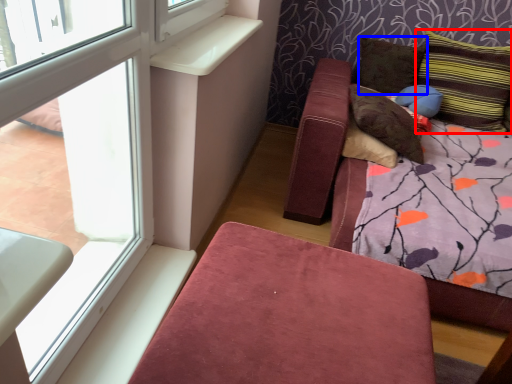
Question: Among these objects, which one is nearest to the camera, pillow (highlighted by a red box) or pillow (highlighted by a blue box)?

Choices:
 (A) pillow
 (B) pillow

Answer: (A)